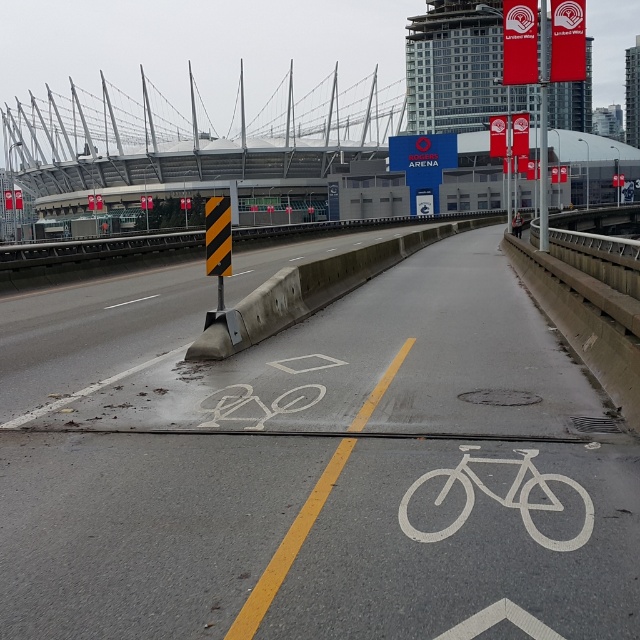
You are a cyclist approaching the white painted bicycle lane at center and the metallic silver bicycle at center on a wet road. You need to park your bicycle in the closest available spot. Which object should you park near?

The metallic silver bicycle at center is closer to you than the white painted bicycle lane at center, so you should park near the metallic silver bicycle at center.

You are a cyclist approaching the Rogers Arena via the bike lane. You notice a point marked at coordinates (193, 136). Where is this point located relative to the bike lane?

The point (193, 136) is on the concrete bridge at upper center, which is not part of the bike lane. The bike lane is on the asphalt in the foreground, so the point is likely above or behind the current bike lane area.